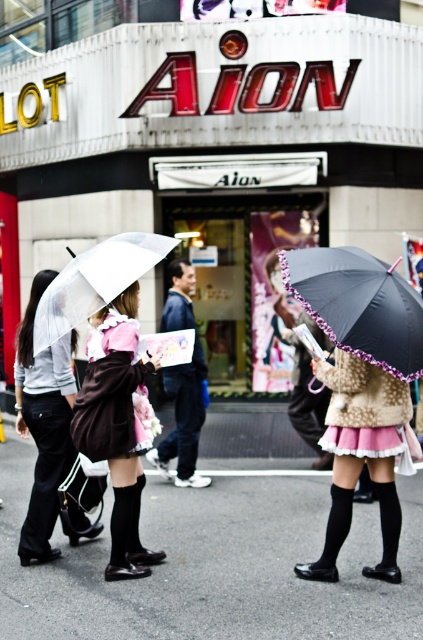
You are a photographer trying to capture the two people in the scene. The matte pink skirt at center and the transparent plastic umbrella at center are both in your viewfinder. Which object is to the right of the other?

The matte pink skirt at center is positioned on the right side of transparent plastic umbrella at center.

You are a fashion designer observing the urban street scene. You notice the matte pink skirt at center and the transparent plastic umbrella at center. Which item has a smaller width?

The matte pink skirt at center has a smaller width than the transparent plastic umbrella at center.